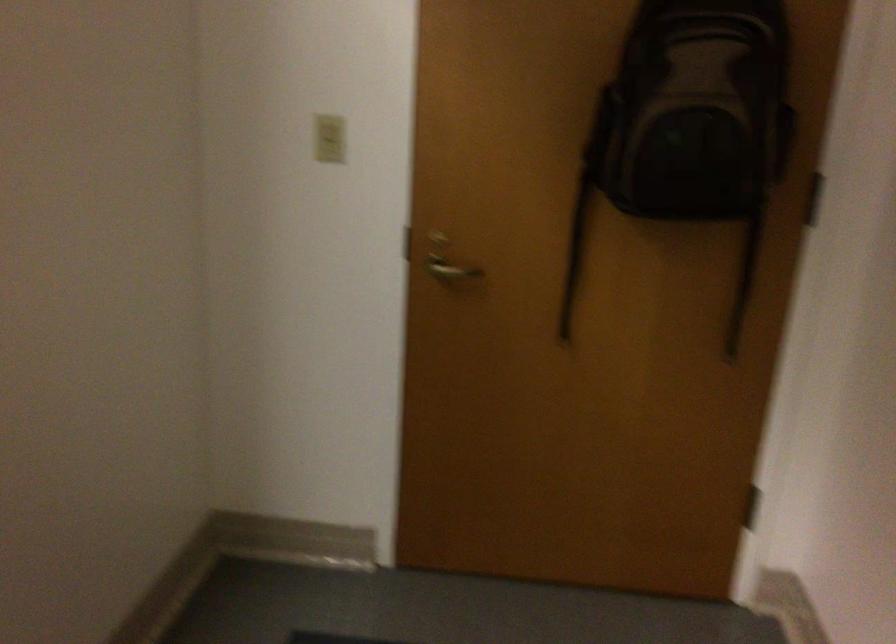
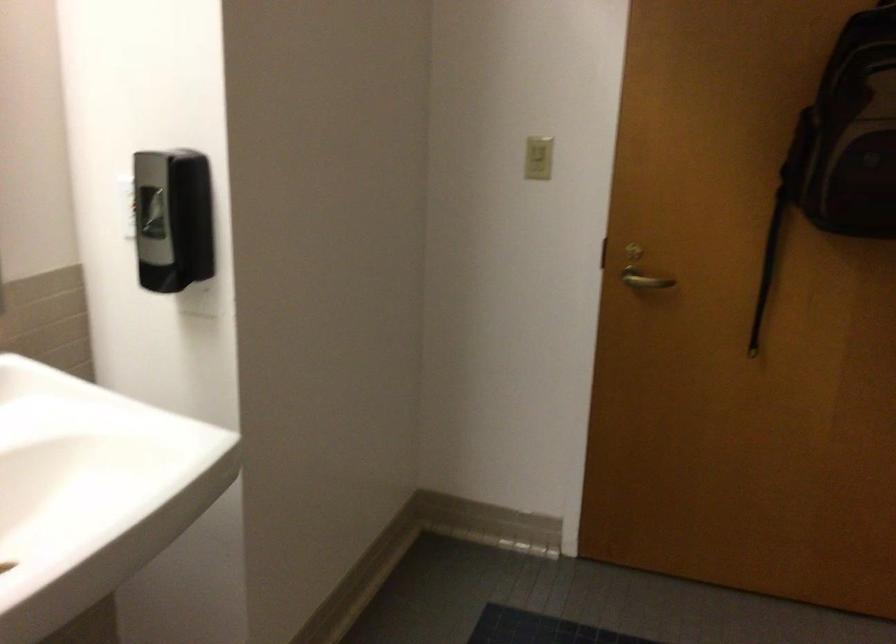
Locate, in the second image, the point that corresponds to point 332,134 in the first image.

(538, 158)